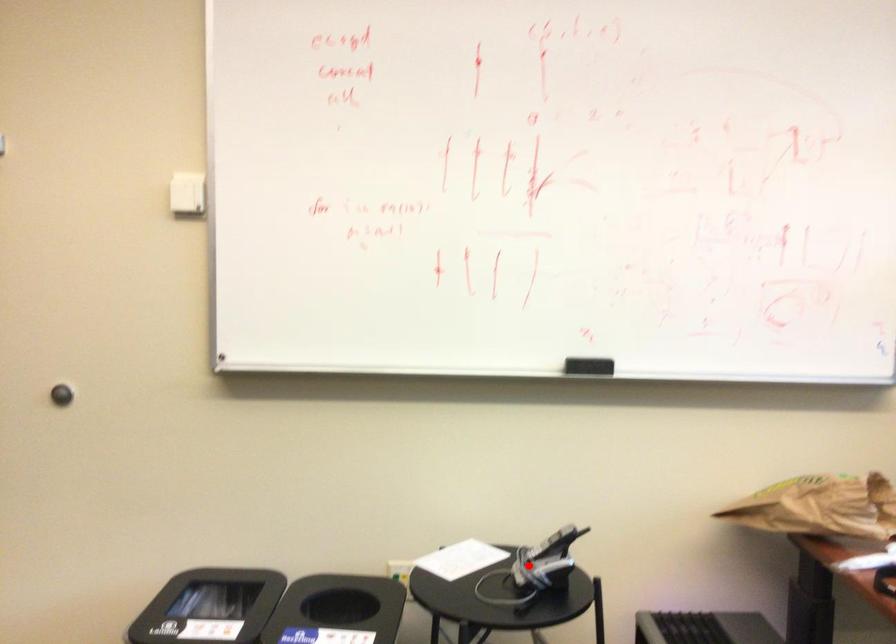
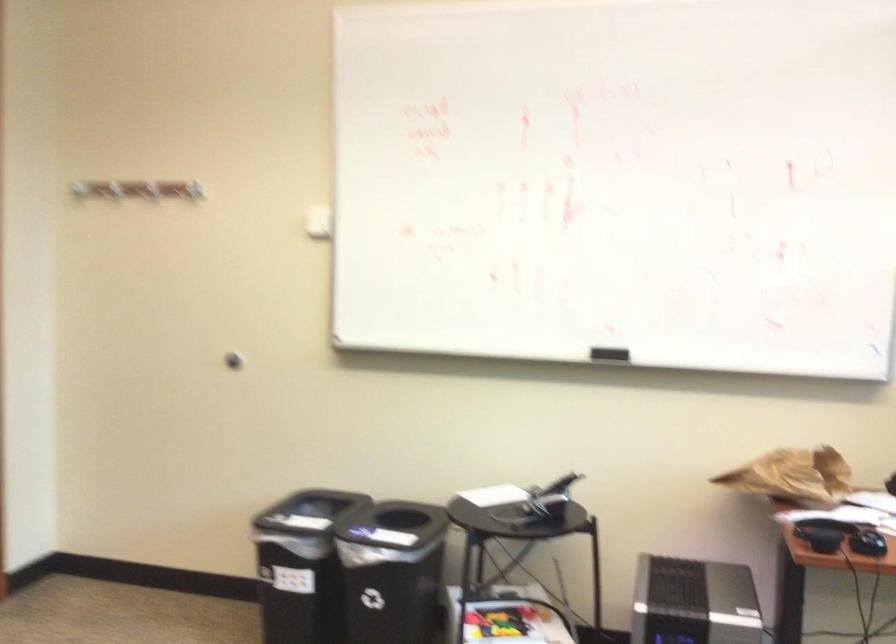
Question: A red point is marked in image1. In image2, is the corresponding 3D point closer to the camera or farther? Reply with the corresponding letter.

Choices:
 (A) The corresponding 3D point is closer.
 (B) The corresponding 3D point is farther.

Answer: (B)